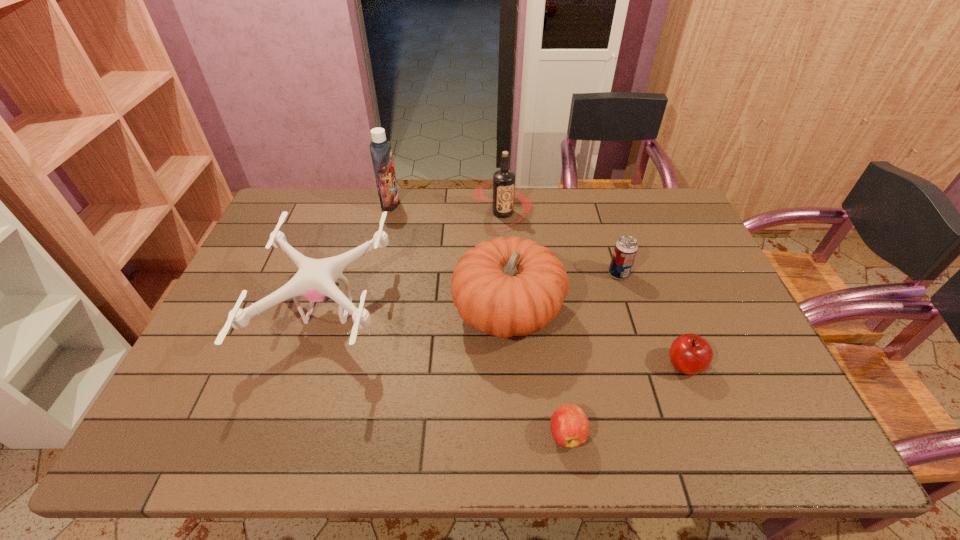
I want to click on blank region between the rightmost object and the second object from right to left, so click(652, 319).

This screenshot has width=960, height=540. Identify the location of free space that is in between the pumpkin and the shampoo. [449, 258].

Locate an element on the screen. This screenshot has width=960, height=540. free space between the second object from right to left and the shorter apple is located at coordinates (592, 354).

Select which object is the sixth closest to the tallest object. Please provide its 2D coordinates. Your answer should be formatted as a tuple, i.e. [(x, y)], where the tuple contains the x and y coordinates of a point satisfying the conditions above.

[(690, 354)]

The height and width of the screenshot is (540, 960). In order to click on object identified as the second closest to the shampoo in this screenshot , I will do `click(503, 184)`.

The width and height of the screenshot is (960, 540). I want to click on vacant space that satisfies the following two spatial constraints: 1. on the front label of the shampoo; 2. on the left side of the sixth object from left to right, so click(372, 274).

Locate an element on the screen. vacant position in the image that satisfies the following two spatial constraints: 1. on the back side of the beer can; 2. on the right side of the pumpkin is located at coordinates (506, 274).

Locate an element on the screen. The height and width of the screenshot is (540, 960). free spot that satisfies the following two spatial constraints: 1. on the back side of the nearest object; 2. on the top of the drone is located at coordinates (549, 310).

Identify the location of vacant space that satisfies the following two spatial constraints: 1. on the front label of the left apple; 2. on the right side of the shampoo. (333, 434).

This screenshot has width=960, height=540. Find the location of `free spot that satisfies the following two spatial constraints: 1. on the back side of the left apple; 2. on the front label of the shampoo`. free spot that satisfies the following two spatial constraints: 1. on the back side of the left apple; 2. on the front label of the shampoo is located at coordinates 534,203.